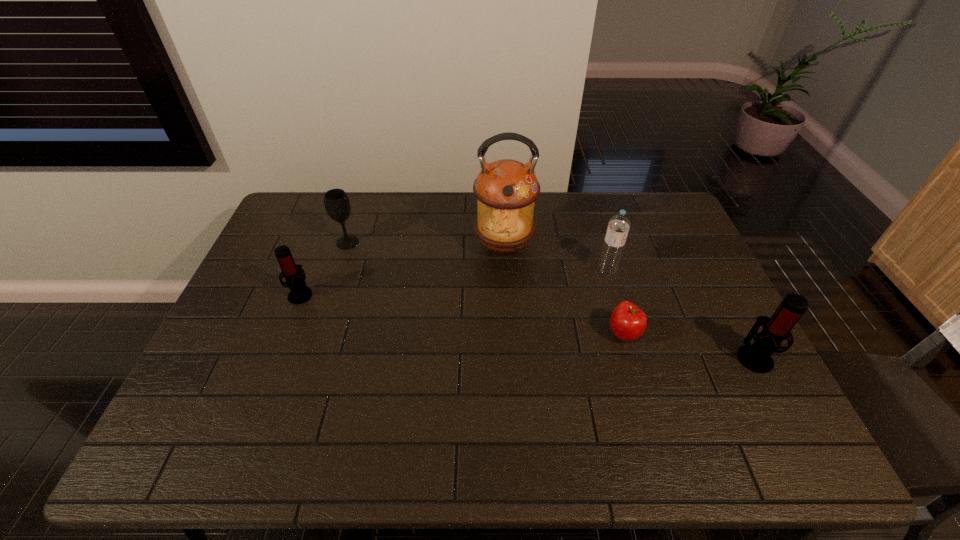
Locate an element on the screen. This screenshot has width=960, height=540. unoccupied position between the leftmost object and the wineglass is located at coordinates click(324, 268).

Locate an element on the screen. The width and height of the screenshot is (960, 540). empty space between the left microphone and the second object from left to right is located at coordinates (324, 268).

Find the location of a particular element. Image resolution: width=960 pixels, height=540 pixels. vacant space that is in between the wineglass and the water bottle is located at coordinates (477, 256).

I want to click on vacant area that lies between the leftmost object and the fourth object from right to left, so click(402, 270).

Locate which object ranks third in proximity to the shortest object. Please provide its 2D coordinates. Your answer should be formatted as a tuple, i.e. [(x, y)], where the tuple contains the x and y coordinates of a point satisfying the conditions above.

[(506, 190)]

What are the coordinates of `object that is the third closest to the fourth farthest object` in the screenshot? It's located at (628, 322).